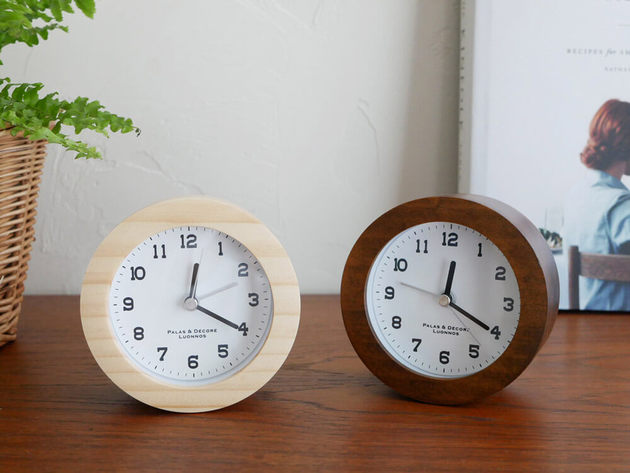
This screenshot has width=630, height=473. Identify the location of chair back. (603, 271).